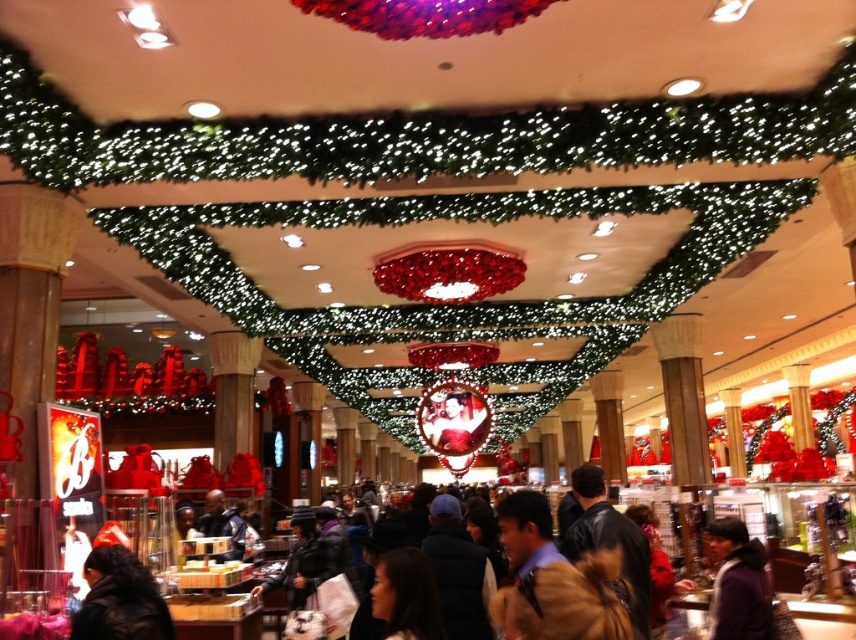
Is purple fuzzy jacket at lower right above dark blue leather jacket at center?

Indeed, purple fuzzy jacket at lower right is positioned over dark blue leather jacket at center.

Which is more to the right, purple fuzzy jacket at lower right or dark blue leather jacket at center?

purple fuzzy jacket at lower right

Is point (756, 632) behind point (220, 557)?

No, it is not.

What are the coordinates of `purple fuzzy jacket at lower right` in the screenshot? It's located at (738, 582).

Find the location of `black leather jacket at lower left`. black leather jacket at lower left is located at coordinates (120, 600).

Is black leather jacket at lower left bigger than brown leather jacket at lower right?

No, black leather jacket at lower left is not bigger than brown leather jacket at lower right.

At what (x,y) coordinates should I click in order to perform the action: click on black leather jacket at lower left. Please return your answer as a coordinate pair (x, y). The height and width of the screenshot is (640, 856). Looking at the image, I should click on (120, 600).

Find the location of a particular element. This screenshot has height=640, width=856. black leather jacket at lower left is located at coordinates (120, 600).

Does black leather jacket at lower left have a lesser width compared to purple fuzzy jacket at lower right?

Incorrect, black leather jacket at lower left's width is not less than purple fuzzy jacket at lower right's.

I want to click on black leather jacket at lower left, so click(120, 600).